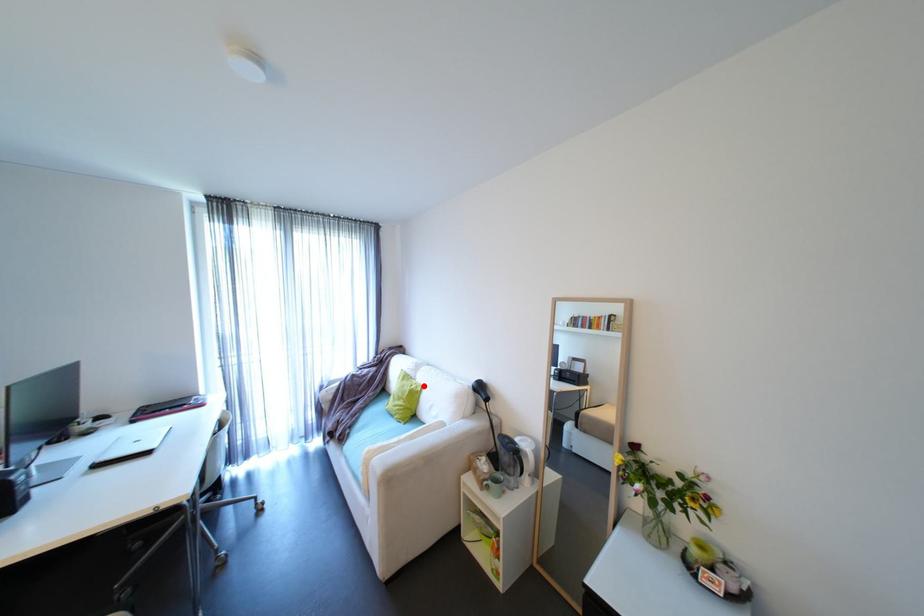
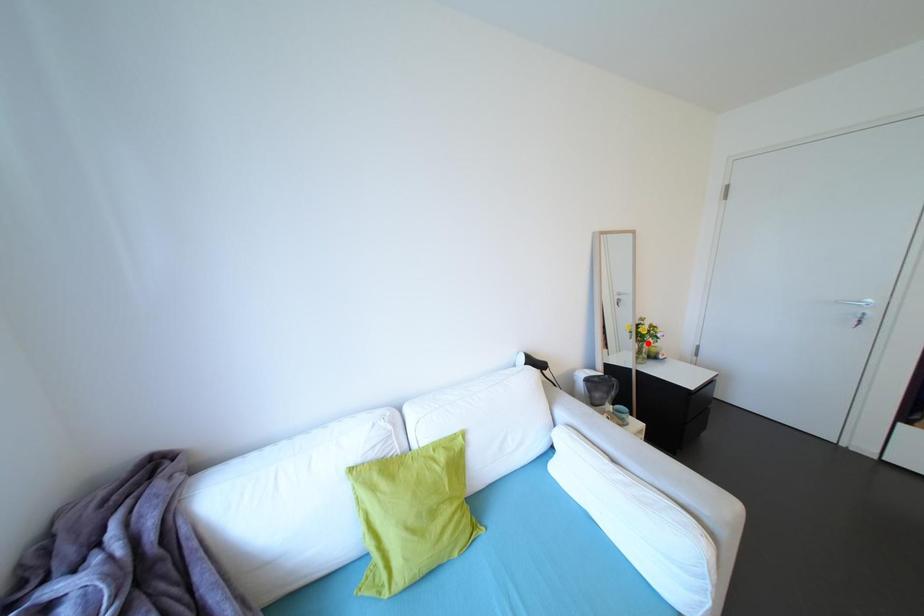
I am providing you with two images of the same scene from different viewpoints. A red point is marked on the first image and another point is marked on the second image. Is the red point in image1 aligned with the point shown in image2?

No